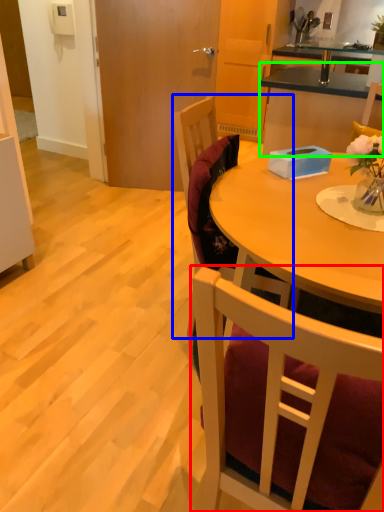
Question: Which object is the closest to the chair (highlighted by a red box)? Choose among these: chair (highlighted by a blue box) or cabinetry (highlighted by a green box).

Choices:
 (A) chair
 (B) cabinetry

Answer: (A)